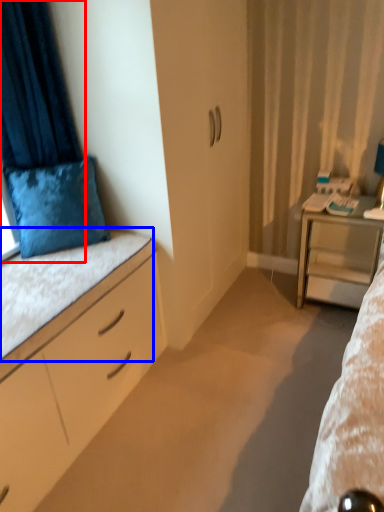
Question: Which point is further to the camera, curtain (highlighted by a red box) or ledge (highlighted by a blue box)?

Choices:
 (A) curtain
 (B) ledge

Answer: (A)